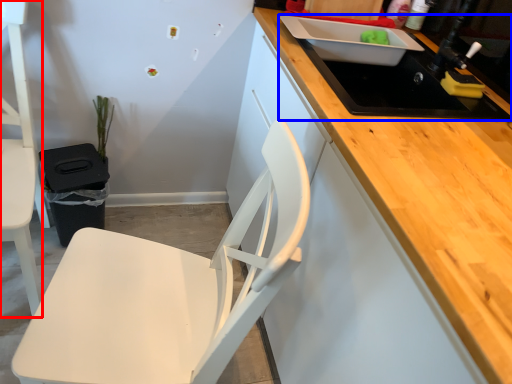
Question: Which point is further to the camera, chair (highlighted by a red box) or sink (highlighted by a blue box)?

Choices:
 (A) chair
 (B) sink

Answer: (B)